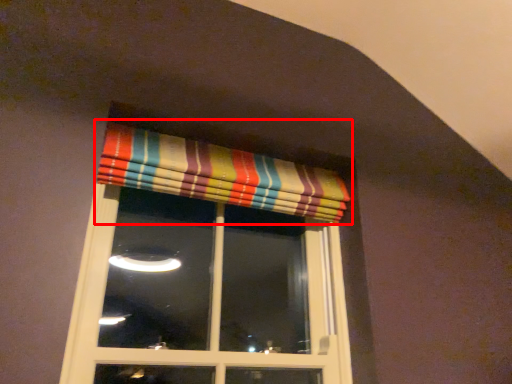
Question: From the image's perspective, where is curtain (annotated by the red box) located relative to window?

Choices:
 (A) above
 (B) below

Answer: (A)